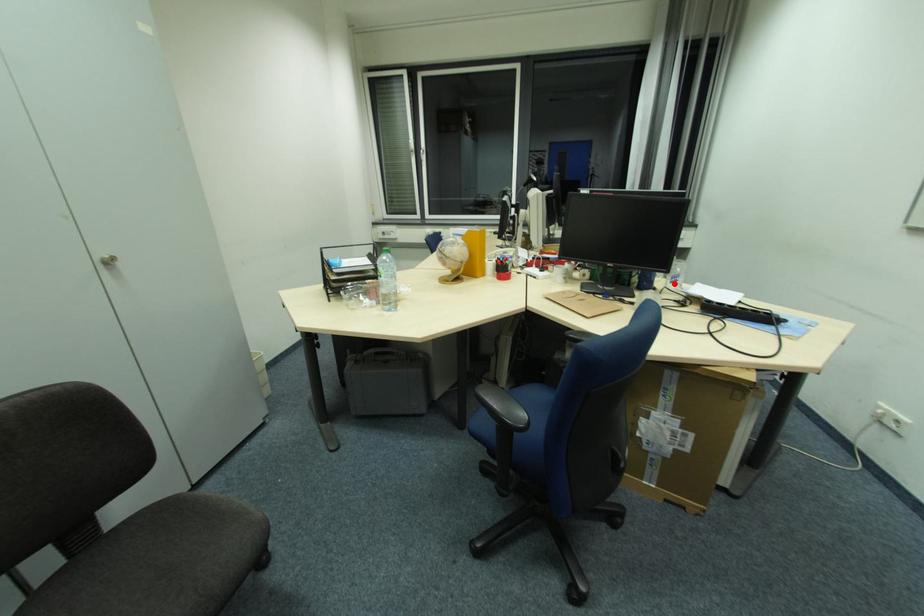
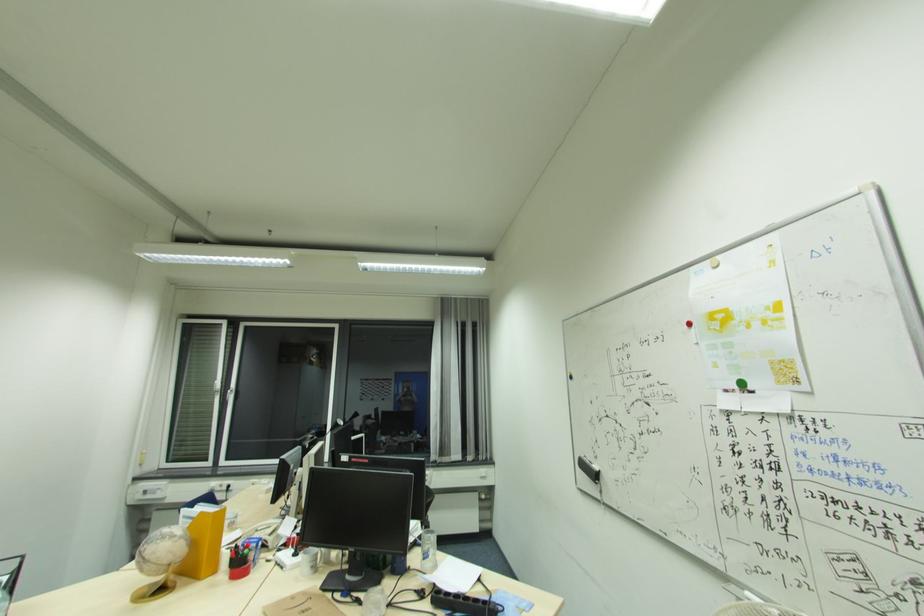
The point at the highlighted location is marked in the first image. Where is the corresponding point in the second image?

(428, 560)